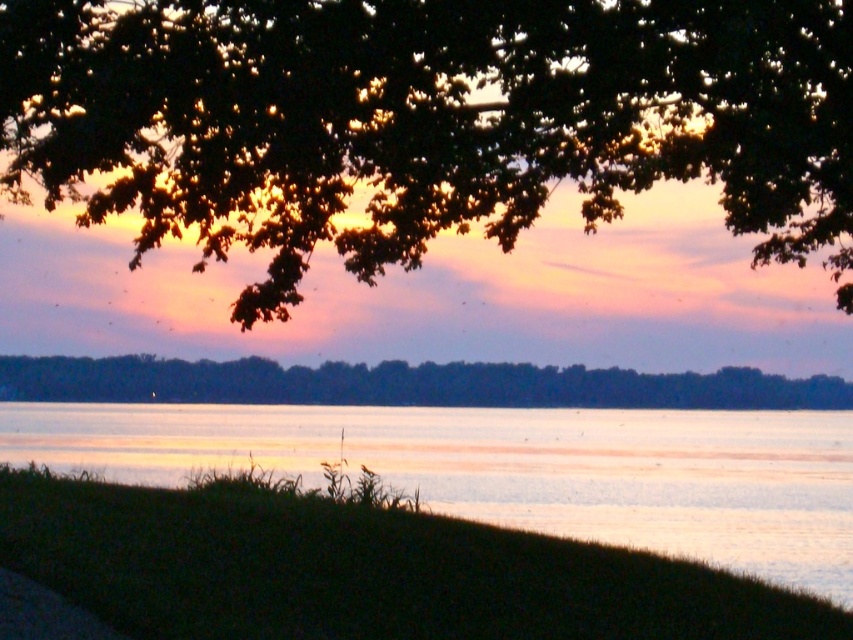
You are an artist trying to paint the sunset scene. You want to place the green leafy tree at upper center and the silvery reflective water at lower center accurately. According to the scene, which object is positioned to the right side of the other?

The green leafy tree at upper center is to the right of the silvery reflective water at lower center.

You are an artist trying to paint the sunset scene. You need to decide the order to paint the trees so that the ones in the foreground are painted last. Which tree should you paint first, the green leafy tree at upper center or the dark green leafy trees at center?

The green leafy tree at upper center should be painted first because it is located above the dark green leafy trees at center, meaning it is farther away and thus should be painted before the foreground elements.